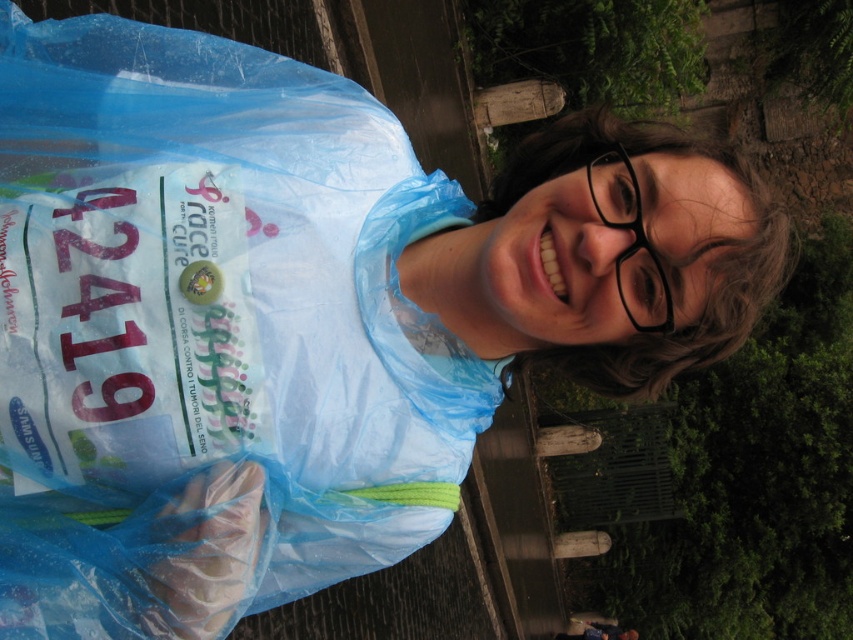
You are standing in the background of the image and want to walk towards the person in the foreground. Which point, point 1 at coordinates (x=105, y=406) or point 2 at coordinates (x=624, y=252), is closer to you as you start walking towards the person?

Point 1 at coordinates (x=105, y=406) is closer to you because it is nearer to the viewer compared to point 2 at coordinates (x=624, y=252).

Consider the image. You are organizing a charity event and need to place the translucent blue plastic bag at center and the black plastic glasses at upper right in a display case. Which item should you place on the left side of the case to ensure they are arranged as shown in the image?

You should place the translucent blue plastic bag at center on the left side of the case because it is to the left of the black plastic glasses at upper right in the image.